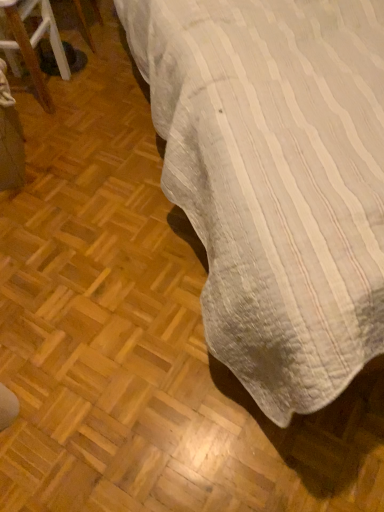
Question: Is black fabric bag at left situated inside white striped fabric at upper right or outside?

Choices:
 (A) inside
 (B) outside

Answer: (B)

Question: Is black fabric bag at left bigger or smaller than white striped fabric at upper right?

Choices:
 (A) big
 (B) small

Answer: (B)

Question: From a real-world perspective, is black fabric bag at left above or below white striped fabric at upper right?

Choices:
 (A) below
 (B) above

Answer: (A)

Question: In terms of width, does white striped fabric at upper right look wider or thinner when compared to black fabric bag at left?

Choices:
 (A) thin
 (B) wide

Answer: (B)

Question: Considering the positions of white striped fabric at upper right and black fabric bag at left in the image, is white striped fabric at upper right taller or shorter than black fabric bag at left?

Choices:
 (A) tall
 (B) short

Answer: (A)

Question: Relative to black fabric bag at left, is white striped fabric at upper right in front or behind?

Choices:
 (A) behind
 (B) front

Answer: (B)

Question: Is point (360, 274) positioned closer to the camera than point (39, 83)?

Choices:
 (A) closer
 (B) farther

Answer: (A)